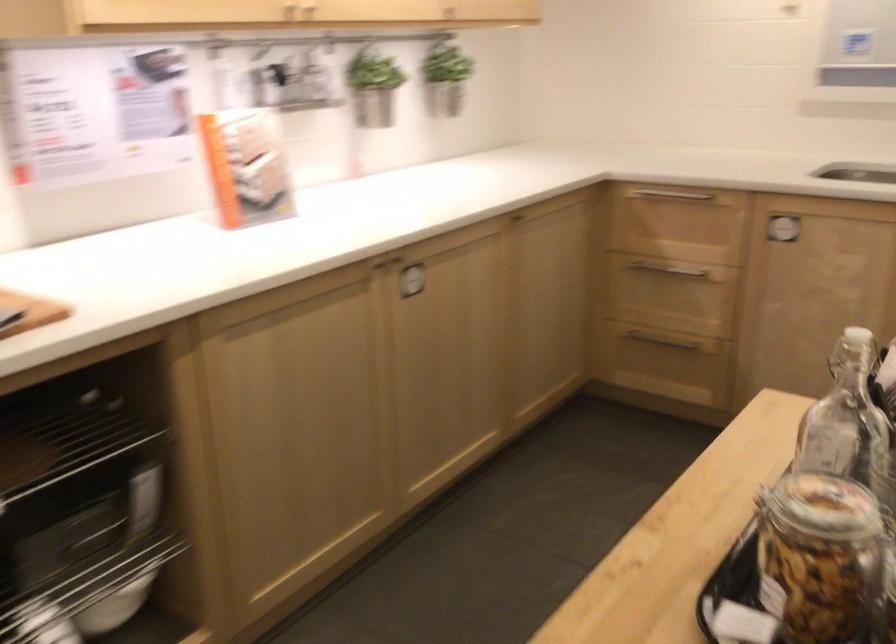
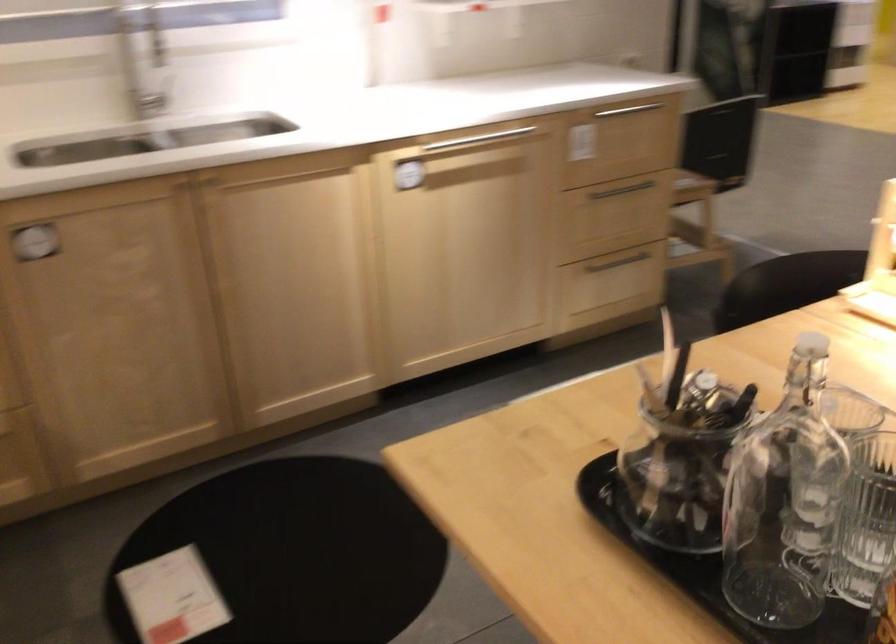
Based on the continuous images, in which direction is the camera rotating?

The rotation direction of the camera is right-down.